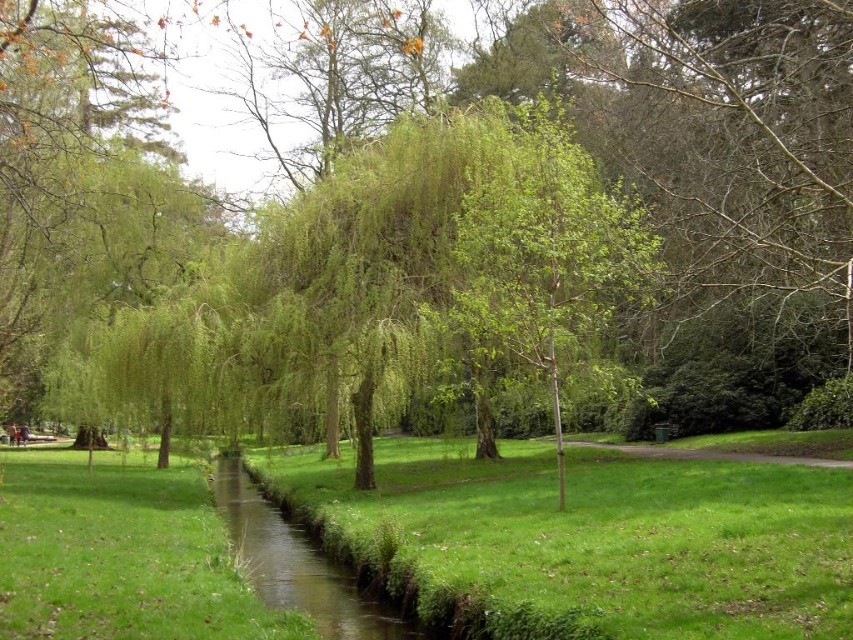
Does green grassy at center have a greater width compared to green grassy waterway at center?

In fact, green grassy at center might be narrower than green grassy waterway at center.

Consider the image. Measure the distance between green grassy at center and camera.

A distance of 6.14 meters exists between green grassy at center and camera.

Identify the location of green grassy at center. [587, 540].

Which of these two, green leafy willow at center or green grassy at center, stands shorter?

With less height is green grassy at center.

Between green leafy willow at center and green grassy at center, which one is positioned higher?

green leafy willow at center is above.

The image size is (853, 640). I want to click on green leafy willow at center, so click(392, 280).

Locate an element on the screen. green leafy willow at center is located at coordinates (392, 280).

Does point (274, 376) lie in front of point (366, 620)?

That is False.

Who is taller, green leafy willow at center or green grassy waterway at center?

With more height is green leafy willow at center.

Does point (560, 168) come closer to viewer compared to point (383, 612)?

No, it is behind (383, 612).

This screenshot has height=640, width=853. Find the location of `green leafy willow at center`. green leafy willow at center is located at coordinates (392, 280).